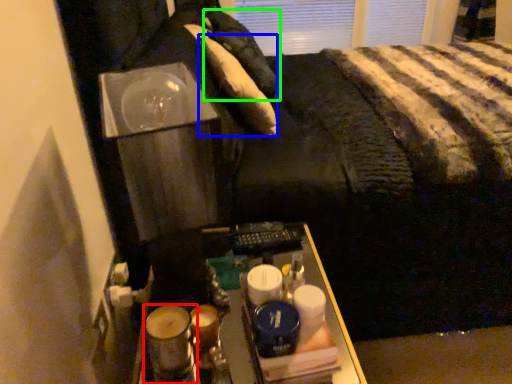
Question: Which is nearer to the beverage (highlighted by a red box)? pillow (highlighted by a blue box) or pillow (highlighted by a green box).

Choices:
 (A) pillow
 (B) pillow

Answer: (A)